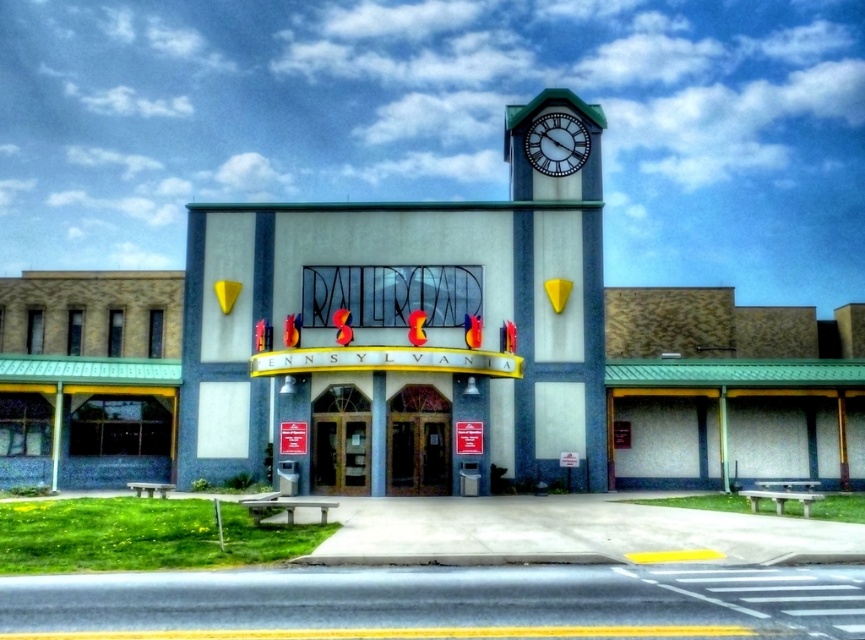
You are a traveler carrying a large suitcase and need to sit down to rest. You see the green matte bench at lower right and the white glossy clock at upper center. Which object can you sit on?

The green matte bench at lower right is the only object suitable for sitting. The white glossy clock at upper center is likely mounted on the wall and not designed for sitting.

You are a visitor at the Pennsylvania Railroad building and want to find a place to sit. You see the white painted concrete clock tower at upper right and the green matte bench at lower right. Which object can you sit on?

The green matte bench at lower right is the object you can sit on, while the white painted concrete clock tower at upper right is taller but not meant for sitting.

You are a traveler standing at the entrance of the Pennsylvania Railroad building. You see the green matte bench at lower right and the white glossy clock at upper center. Which object is closer to you?

The green matte bench at lower right is closer to you because it is in front of the white glossy clock at upper center.